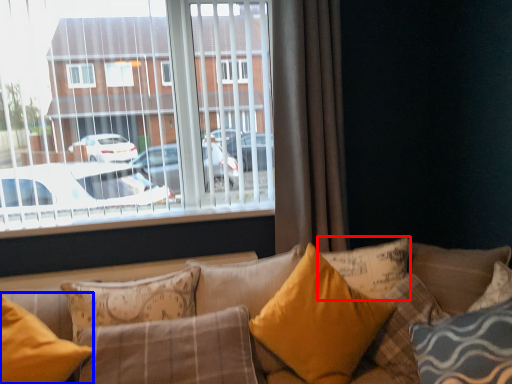
Question: Which point is closer to the camera, pillow (highlighted by a red box) or pillow (highlighted by a blue box)?

Choices:
 (A) pillow
 (B) pillow

Answer: (B)